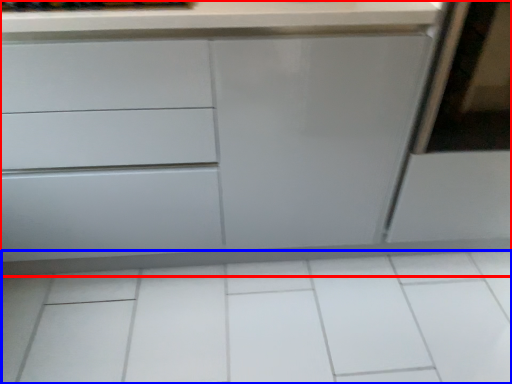
Question: Which point is further to the camera, chest of drawers (highlighted by a red box) or ceramic tile (highlighted by a blue box)?

Choices:
 (A) chest of drawers
 (B) ceramic tile

Answer: (B)